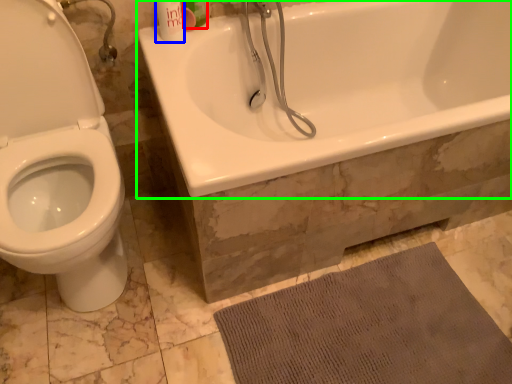
Question: Which object is the closest to the mouthwash (highlighted by a red box)? Choose among these: mouthwash (highlighted by a blue box) or bathtub (highlighted by a green box).

Choices:
 (A) mouthwash
 (B) bathtub

Answer: (A)